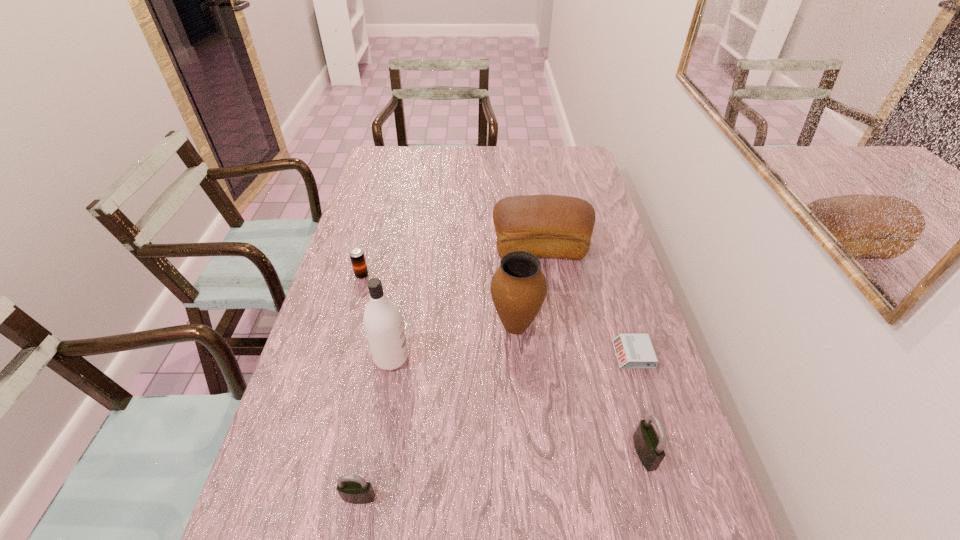
Locate an element on the screen. The width and height of the screenshot is (960, 540). shampoo is located at coordinates (382, 319).

Find the location of a particular element. The height and width of the screenshot is (540, 960). vacant area situated on the left of the nearer padlock is located at coordinates (283, 497).

Where is `free region located 0.280m on the back of the farther padlock`? free region located 0.280m on the back of the farther padlock is located at coordinates (612, 335).

Find the location of `vacant area situated on the right of the leftmost object`. vacant area situated on the right of the leftmost object is located at coordinates (480, 275).

The image size is (960, 540). Find the location of `free region located 0.200m on the back of the third tallest object`. free region located 0.200m on the back of the third tallest object is located at coordinates (533, 198).

In order to click on free region located 0.290m on the front of the urn in this screenshot , I will do `click(525, 455)`.

Image resolution: width=960 pixels, height=540 pixels. Find the location of `free spot located on the back of the alarm clock`. free spot located on the back of the alarm clock is located at coordinates (623, 321).

Where is `vacant space located 0.240m on the front-facing side of the shampoo`? vacant space located 0.240m on the front-facing side of the shampoo is located at coordinates (502, 358).

Find the location of `object situated at the near edge`. object situated at the near edge is located at coordinates (354, 489).

Find the location of a particular element. The width and height of the screenshot is (960, 540). object that is at the left edge is located at coordinates (356, 254).